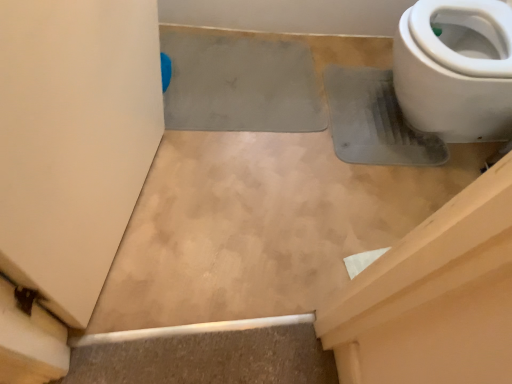
Question: Is the depth of white glossy toilet at upper right less than that of gray rubber mat at center?

Choices:
 (A) yes
 (B) no

Answer: (A)

Question: Does white glossy toilet at upper right appear on the left side of gray rubber mat at center?

Choices:
 (A) yes
 (B) no

Answer: (B)

Question: From the image's perspective, is white glossy toilet at upper right below gray rubber mat at center?

Choices:
 (A) yes
 (B) no

Answer: (B)

Question: Is gray rubber mat at center a part of white glossy toilet at upper right?

Choices:
 (A) yes
 (B) no

Answer: (B)

Question: Is white glossy toilet at upper right facing towards gray rubber mat at center?

Choices:
 (A) no
 (B) yes

Answer: (B)

Question: Are white glossy toilet at upper right and gray rubber mat at center located far from each other?

Choices:
 (A) yes
 (B) no

Answer: (B)

Question: Does gray rubber mat at center turn towards white glossy toilet at upper right?

Choices:
 (A) no
 (B) yes

Answer: (A)

Question: From the image's perspective, would you say gray rubber mat at center is shown under white glossy toilet at upper right?

Choices:
 (A) yes
 (B) no

Answer: (A)

Question: Is gray rubber mat at center smaller than white glossy toilet at upper right?

Choices:
 (A) no
 (B) yes

Answer: (B)

Question: Can you confirm if gray rubber mat at center is shorter than white glossy toilet at upper right?

Choices:
 (A) no
 (B) yes

Answer: (B)

Question: Is gray rubber mat at center not near white glossy toilet at upper right?

Choices:
 (A) yes
 (B) no

Answer: (B)

Question: Does gray rubber mat at center appear on the left side of white glossy toilet at upper right?

Choices:
 (A) no
 (B) yes

Answer: (B)

Question: Based on their sizes in the image, would you say white glossy toilet at upper right is bigger or smaller than gray rubber mat at center?

Choices:
 (A) big
 (B) small

Answer: (A)